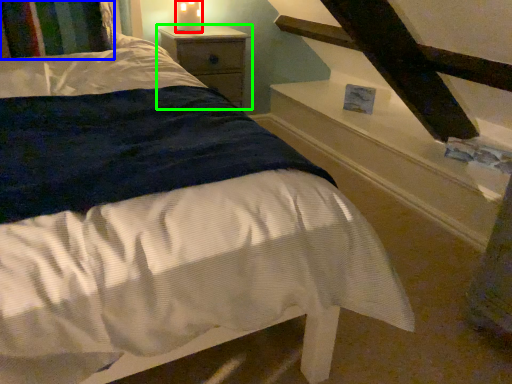
Question: Estimate the real-world distances between objects in this image. Which object is farther from candle holder (highlighted by a red box), pillow (highlighted by a blue box) or nightstand (highlighted by a green box)?

Choices:
 (A) pillow
 (B) nightstand

Answer: (A)